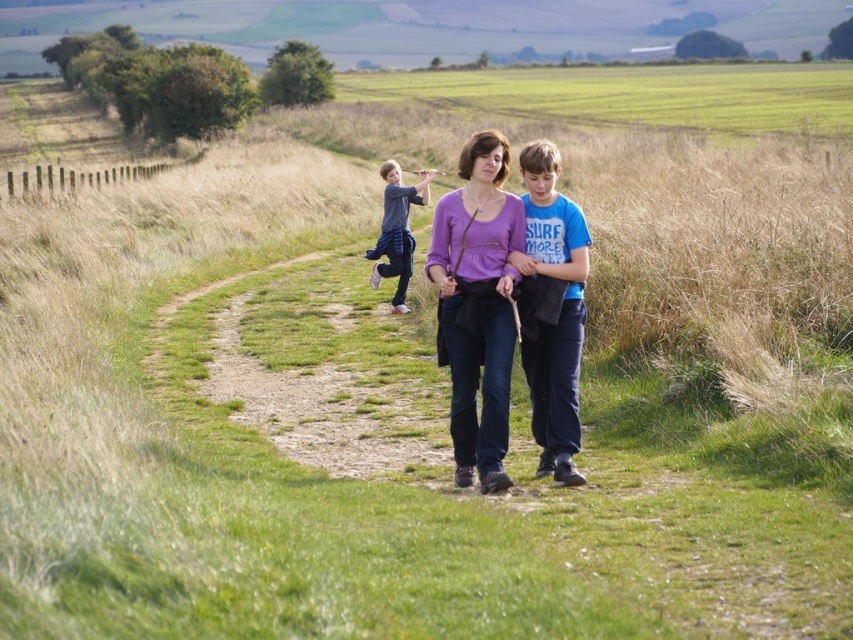
From the picture: You are a photographer trying to capture a group photo of the purple matte shirt at center and the dark gray cotton shirt at center. Which person should you position closer to the camera to ensure both appear equally tall in the photo?

To make both the purple matte shirt at center and the dark gray cotton shirt at center appear equally tall in the photo, position the purple matte shirt at center closer to the camera since it is shorter than the dark gray cotton shirt at center.

You are a photographer trying to capture a group photo of the purple matte shirt at center and the blue cotton shirt at center. The camera lens has a maximum width of 1.2 meters. Can both subjects fit within the frame if they stand side by side?

The purple matte shirt at center might be wider than blue cotton shirt at center, but since the exact width isn not provided, it is uncertain whether both can fit within the 1.2 meter frame. Further measurement is needed.

You are a photographer trying to capture a group photo of the blue cotton shirt at center and dark gray cotton shirt at center. If you want to ensure both shirts are fully visible in the frame, which shirt should you focus on to avoid cropping the edges?

The blue cotton shirt at center has a smaller width than the dark gray cotton shirt at center. To ensure both are fully visible, focus on the wider dark gray cotton shirt at center to avoid cropping its edges.